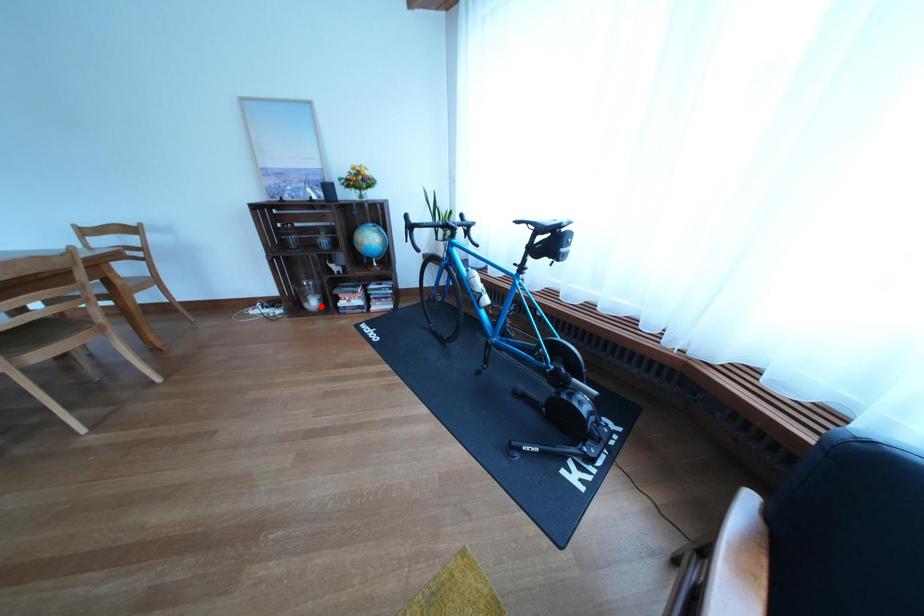
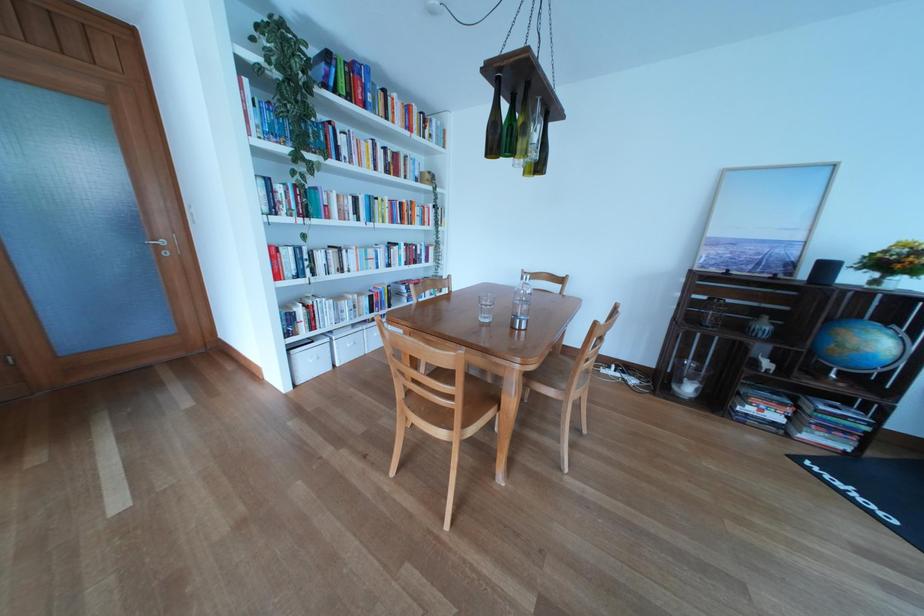
Question: A red point is marked in image1. In image2, is the corresponding 3D point closer to the camera or farther? Reply with the corresponding letter.

Choices:
 (A) The corresponding 3D point is closer.
 (B) The corresponding 3D point is farther.

Answer: (A)